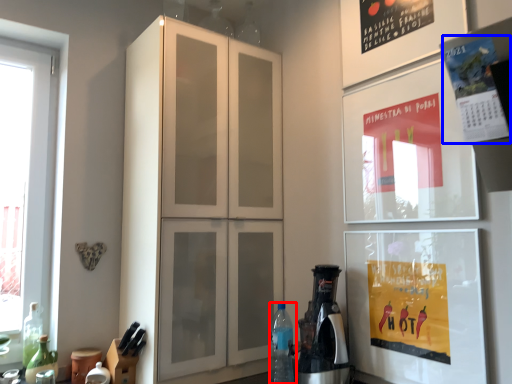
Question: Which of the following is the farthest to the observer, bottle (highlighted by a red box) or poster (highlighted by a blue box)?

Choices:
 (A) bottle
 (B) poster

Answer: (A)